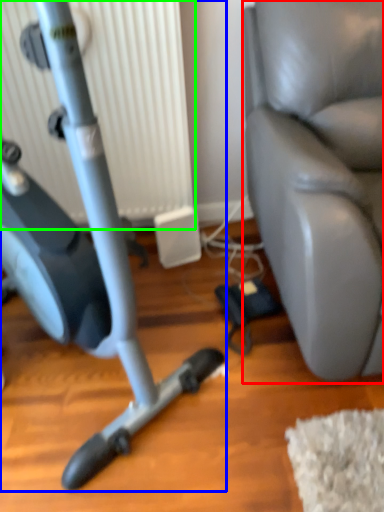
Question: Which is farther away from swivel chair (highlighted by a red box)? stationary bicycle (highlighted by a blue box) or radiator (highlighted by a green box)?

Choices:
 (A) stationary bicycle
 (B) radiator

Answer: (A)